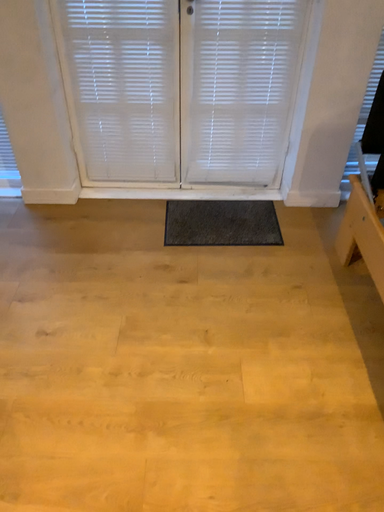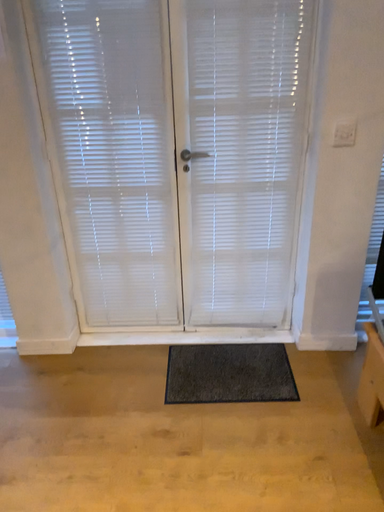
Question: Which way did the camera rotate in the video?

Choices:
 (A) rotated downward
 (B) rotated upward

Answer: (B)